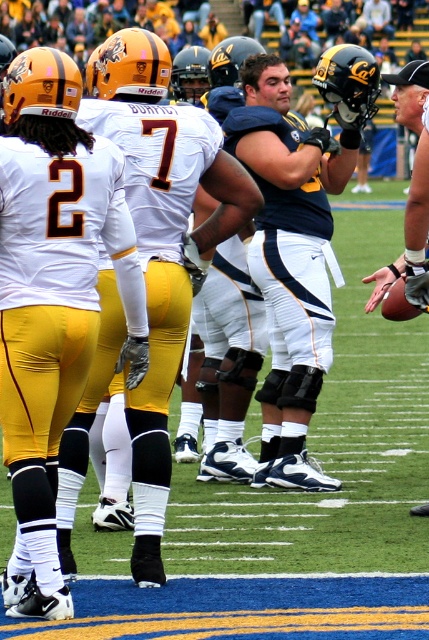
Question: Which point appears farthest from the camera in this image?

Choices:
 (A) (56, 138)
 (B) (422, 65)

Answer: (B)

Question: Which point appears closest to the camera in this image?

Choices:
 (A) (63, 84)
 (B) (380, 276)

Answer: (A)

Question: Is matte white jersey at left bigger than black matte helmet at upper right?

Choices:
 (A) yes
 (B) no

Answer: (B)

Question: Is matte white jersey at left closer to the viewer compared to black matte helmet at upper right?

Choices:
 (A) no
 (B) yes

Answer: (B)

Question: Is matte white jersey at left behind black matte helmet at upper right?

Choices:
 (A) yes
 (B) no

Answer: (B)